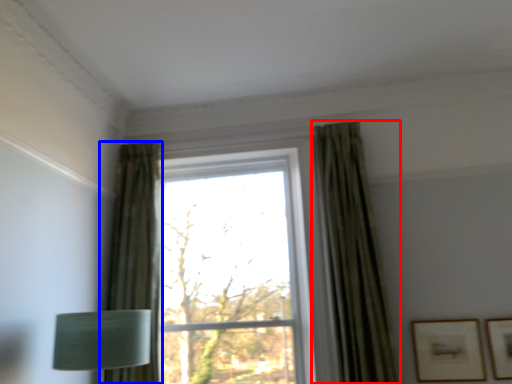
Question: Which object is closer to the camera taking this photo, curtain (highlighted by a red box) or curtain (highlighted by a blue box)?

Choices:
 (A) curtain
 (B) curtain

Answer: (A)